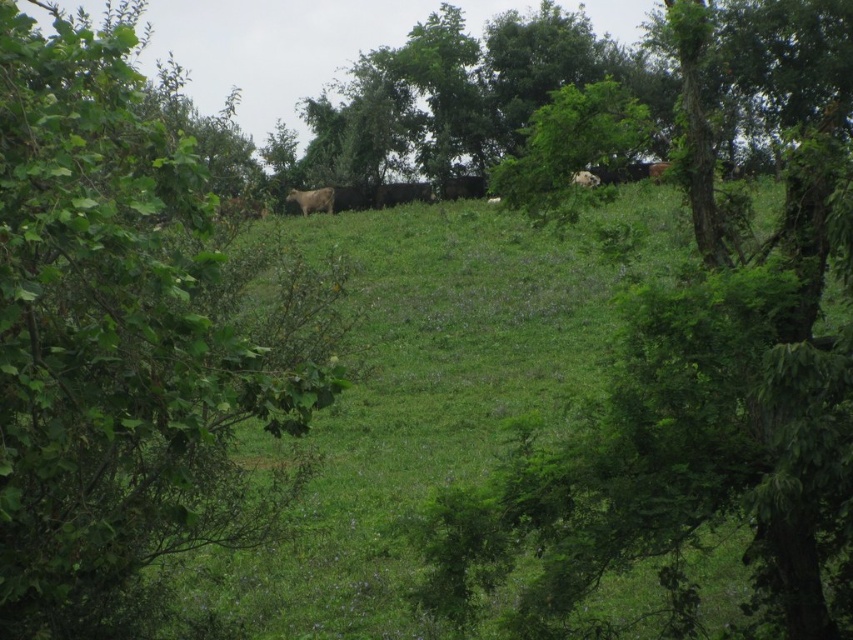
Question: Which of the following is the closest to the observer?

Choices:
 (A) (149, 428)
 (B) (306, 196)

Answer: (A)

Question: Can you confirm if green leafy tree at center is wider than white woolly sheep at center?

Choices:
 (A) yes
 (B) no

Answer: (A)

Question: Does green leafy tree at center appear on the left side of white fur at upper center?

Choices:
 (A) no
 (B) yes

Answer: (A)

Question: Does green leafy tree at center have a larger size compared to white fur at upper center?

Choices:
 (A) no
 (B) yes

Answer: (B)

Question: Which is nearer to the green leafy tree at left?

Choices:
 (A) white woolly sheep at center
 (B) green leafy tree at center

Answer: (B)

Question: Which object is closer to the camera taking this photo?

Choices:
 (A) white woolly sheep at center
 (B) white fur at upper center
 (C) green leafy tree at center

Answer: (C)